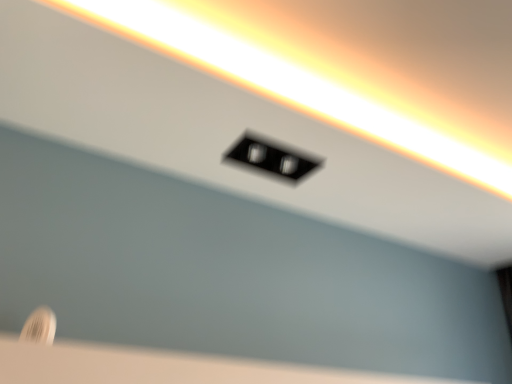
What do you see at coordinates (288, 84) in the screenshot?
I see `matte white light at upper center` at bounding box center [288, 84].

The height and width of the screenshot is (384, 512). In order to click on matte white light at upper center in this screenshot , I will do `click(288, 84)`.

You are a GUI agent. You are given a task and a screenshot of the screen. Output one action in this format:
    pyautogui.click(x=<x>, y=<y>)
    Task: Click on the matte white light at upper center
    This screenshot has width=512, height=384.
    Given the screenshot: What is the action you would take?
    pyautogui.click(x=288, y=84)